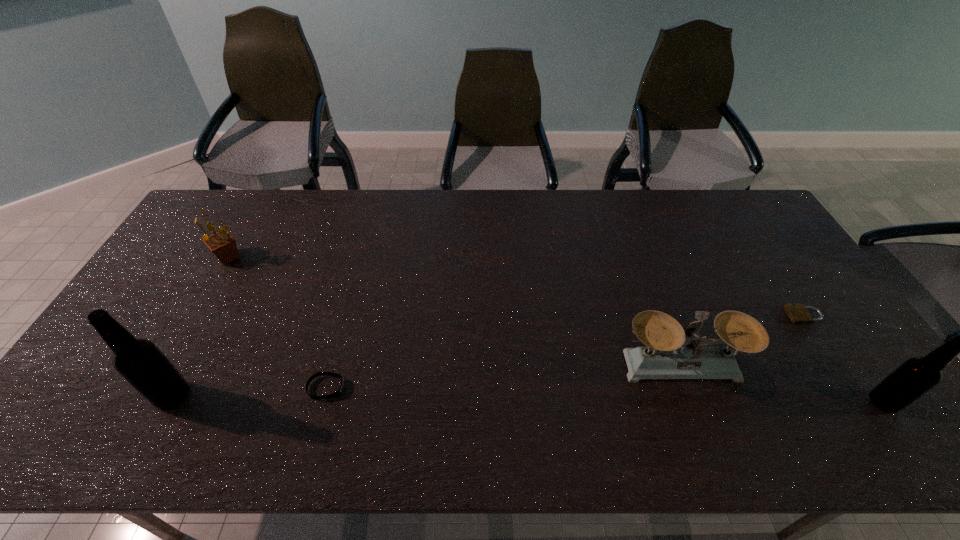
Please determine a free point for an extra beer_bottle to ensure balance. Please provide its 2D coordinates. Your answer should be formatted as a tuple, i.e. [(x, y)], where the tuple contains the x and y coordinates of a point satisfying the conditions above.

[(526, 399)]